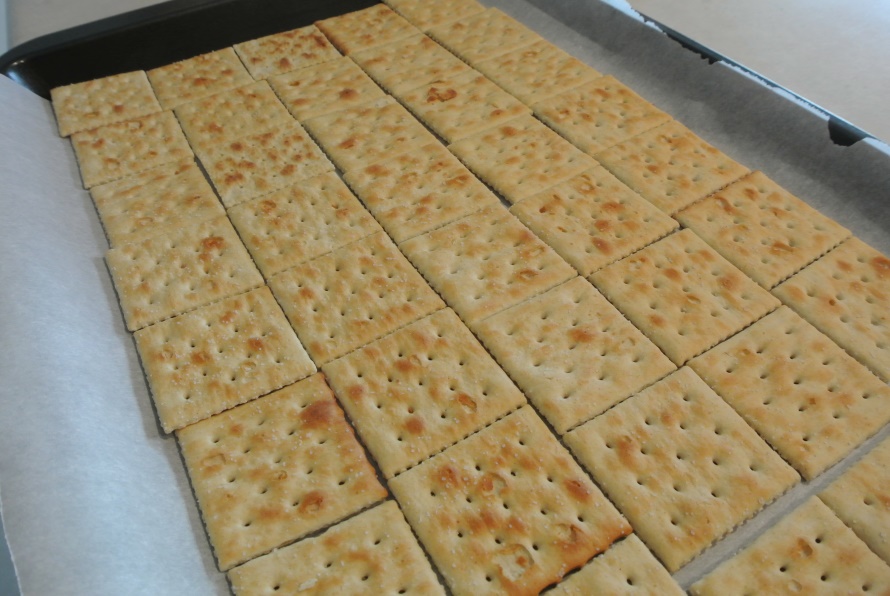
This screenshot has height=596, width=890. I want to click on tray, so click(x=837, y=134).